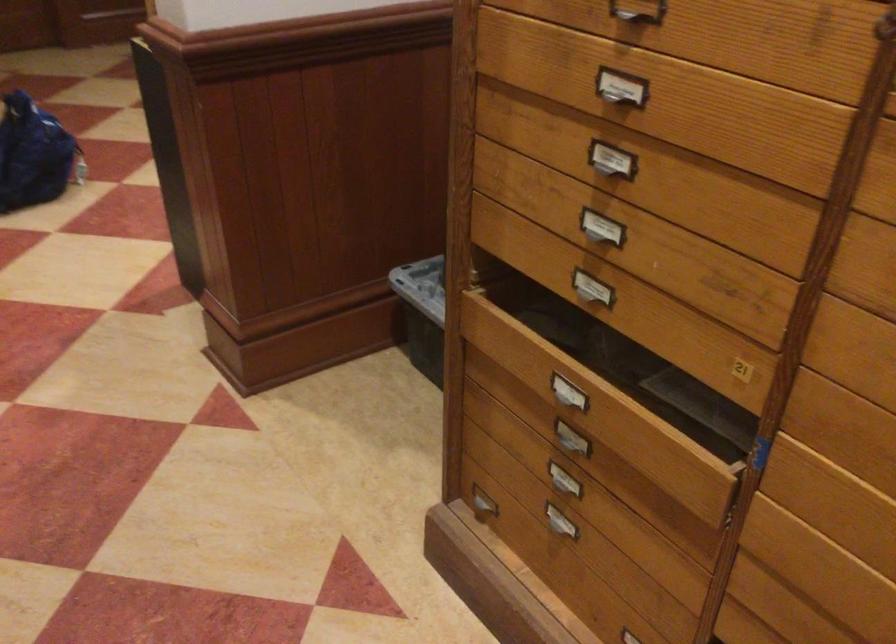
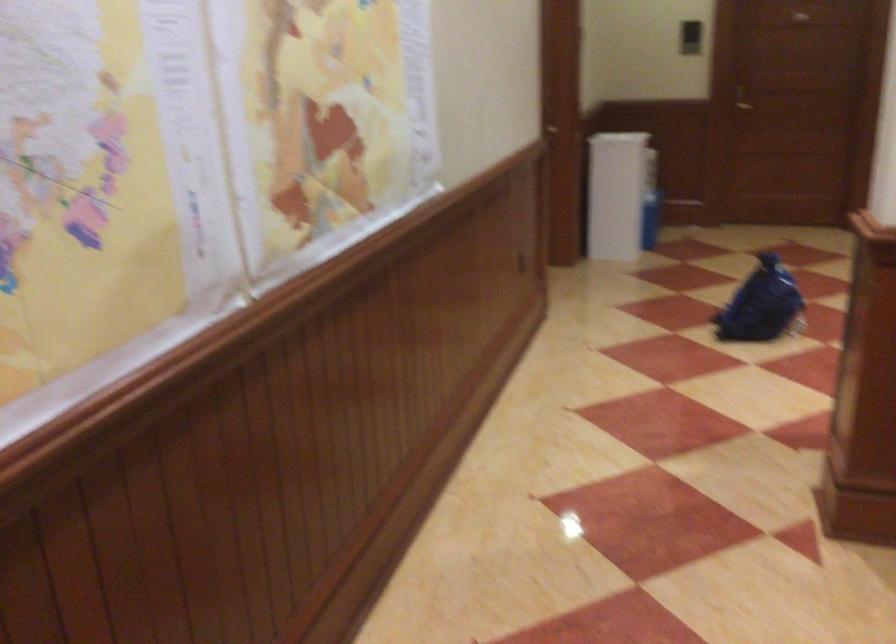
Question: Based on the continuous images, in which direction is the camera rotating? Reply with the corresponding letter.

Choices:
 (A) Left
 (B) Right
 (C) Up
 (D) Down

Answer: (A)